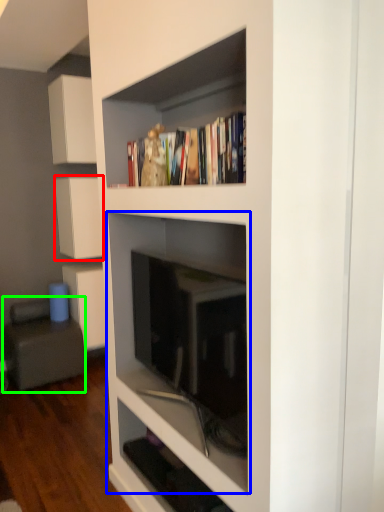
Question: Which object is positioned farthest from cabinetry (highlighted by a red box)? Select from shelf (highlighted by a blue box) and armchair (highlighted by a green box).

Choices:
 (A) shelf
 (B) armchair

Answer: (A)